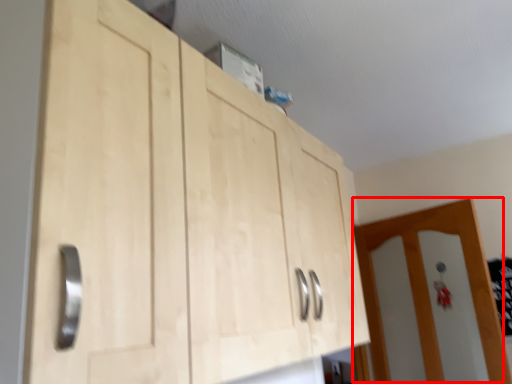
Question: Considering the relative positions of door (annotated by the red box) and cupboard in the image provided, where is door (annotated by the red box) located with respect to the staircase?

Choices:
 (A) left
 (B) right

Answer: (B)